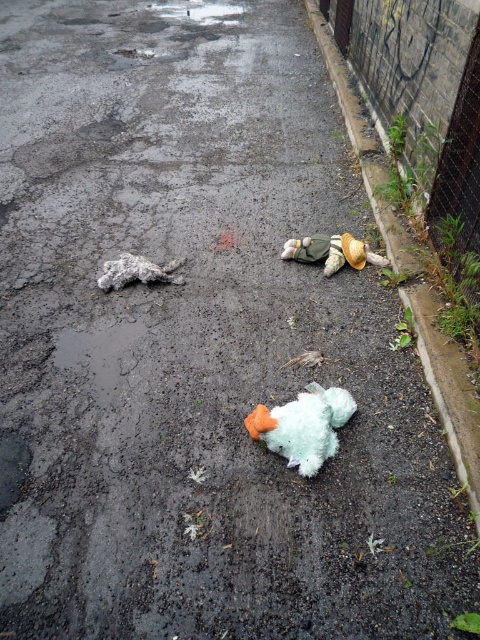
Question: Considering the real-world distances, which object is farthest from the fuzzy fabric teddy bear at center?

Choices:
 (A) fuzzy teal stuffed animal at center
 (B) concrete curb at right
 (C) fuzzy gray animal at upper left

Answer: (A)

Question: Is fuzzy teal stuffed animal at center closer to the viewer compared to fuzzy fabric teddy bear at center?

Choices:
 (A) no
 (B) yes

Answer: (B)

Question: Can you confirm if fuzzy fabric teddy bear at center is positioned above fuzzy gray animal at upper left?

Choices:
 (A) no
 (B) yes

Answer: (B)

Question: Among these points, which one is nearest to the camera?

Choices:
 (A) (363, 257)
 (B) (111, 264)
 (C) (368, 189)

Answer: (B)

Question: Which point is farther to the camera?

Choices:
 (A) fuzzy teal stuffed animal at center
 (B) fuzzy gray animal at upper left
 (C) concrete curb at right

Answer: (B)

Question: Is fuzzy teal stuffed animal at center below fuzzy fabric teddy bear at center?

Choices:
 (A) yes
 (B) no

Answer: (A)